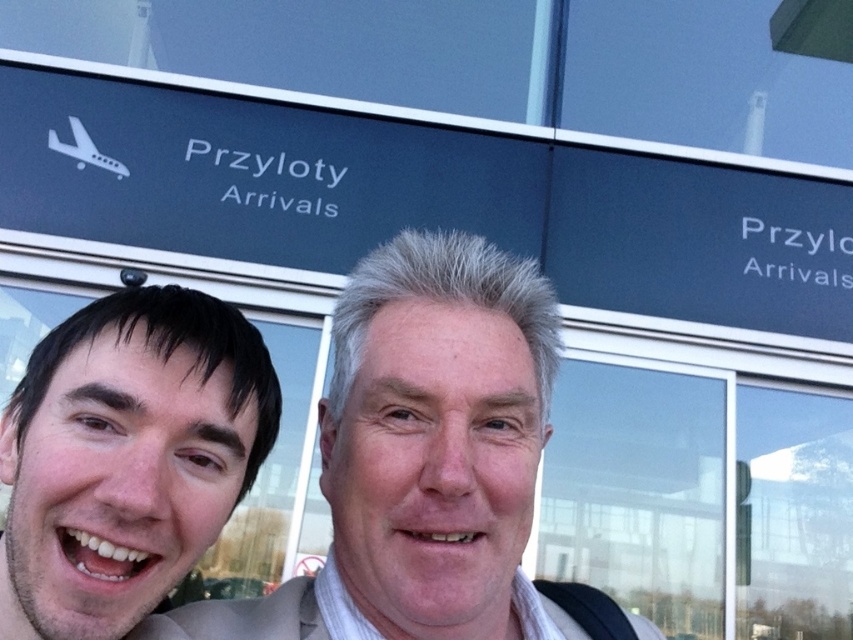
You are taking a photo of two people standing in front of a glass facade labeled with arrivals signs. You want to focus on the person closer to the camera. Which of the two points, point (325,580) or point (24,586), should you focus on?

Point (325,580) is further to the camera than point (24,586), so you should focus on point (325,580) to capture the person closer to the camera.

You are a photographer trying to frame a photo of the smooth skin face at center and the smooth skin face at left. Based on their sizes in the image, which face should you focus on to ensure both fit comfortably in the frame?

The smooth skin face at center might be wider than smooth skin face at left, so focusing on the wider face would help ensure both fit comfortably in the frame.